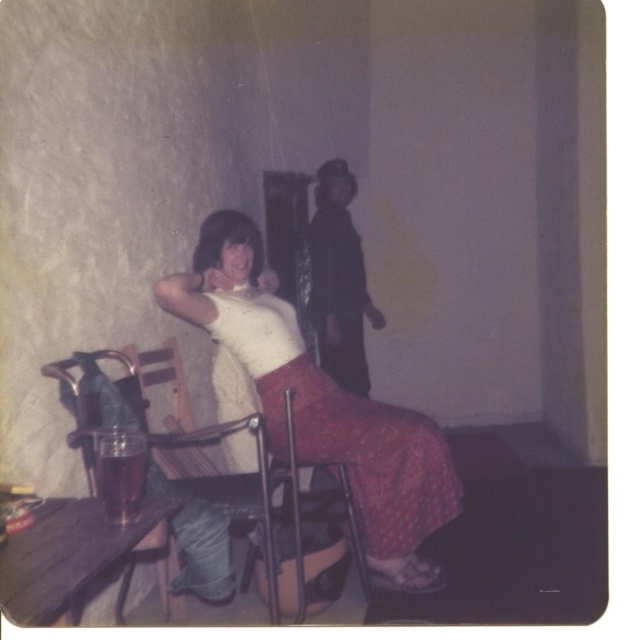
Is wooden table at lower left behind dark gray fabric jacket at center?

That is False.

Between wooden table at lower left and dark gray fabric jacket at center, which one has more height?

dark gray fabric jacket at center is taller.

Which is in front, point (42, 593) or point (328, 225)?

Point (42, 593) is more forward.

The height and width of the screenshot is (640, 625). Identify the location of wooden table at lower left. (66, 556).

Does wooden chair at lower left appear on the right side of dark gray fabric jacket at center?

Incorrect, wooden chair at lower left is not on the right side of dark gray fabric jacket at center.

Between wooden chair at lower left and dark gray fabric jacket at center, which one has more height?

Standing taller between the two is dark gray fabric jacket at center.

Is point (121, 410) positioned in front of point (316, 237)?

That is True.

The image size is (625, 640). I want to click on wooden chair at lower left, so click(212, 513).

Can you confirm if wooden chair at lower left is positioned above wooden table at lower left?

Yes, wooden chair at lower left is above wooden table at lower left.

Does wooden chair at lower left have a lesser height compared to wooden table at lower left?

No.

Is point (92, 396) less distant than point (51, 564)?

No, it is not.

Identify the location of wooden chair at lower left. (212, 513).